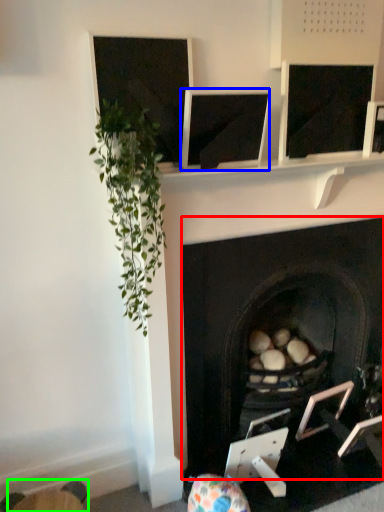
Question: Based on their relative distances, which object is farther from fireplace (highlighted by a red box)? Choose from computer screen (highlighted by a blue box) and swivel chair (highlighted by a green box).

Choices:
 (A) computer screen
 (B) swivel chair

Answer: (B)